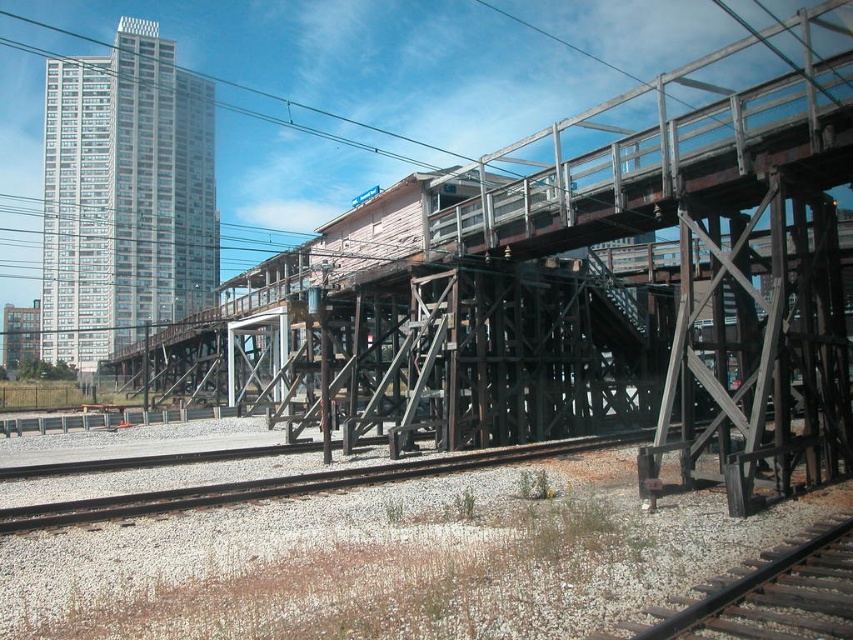
Based on the photo, you are a construction worker assessing the site. You need to install a safety net between the brown wooden train track at lower right and the black wire at upper center. Given their positions, can you safely install the net without it interfering with the wire?

The brown wooden train track at lower right is below the black wire at upper center, so installing a safety net between them should be possible without interfering with the wire as long as the net is kept taut and does not sag upwards towards the wire.

You are a delivery drone that needs to fly over the wooden bridge at center and the brown wooden train track at lower right. Given that your maximum flight altitude is 2 meters, can you safely navigate between them without hitting any obstacles?

Answer: The wooden bridge at center is taller than the brown wooden train track at lower right. Since the drone has a maximum flight altitude of 2 meters, it must ensure that the bridge is not higher than this limit. However, the description does not provide specific measurements for the bridge or track heights, so we cannot determine if the drone can safely navigate based on the given information.

You are a maintenance worker standing on the wooden bridge at center. You need to inspect the brown wooden train track at lower right. Which direction should you move to reach it?

You should move towards the lower right direction to reach the brown wooden train track at lower right since it is located below and to the right of your current position on the wooden bridge at center.